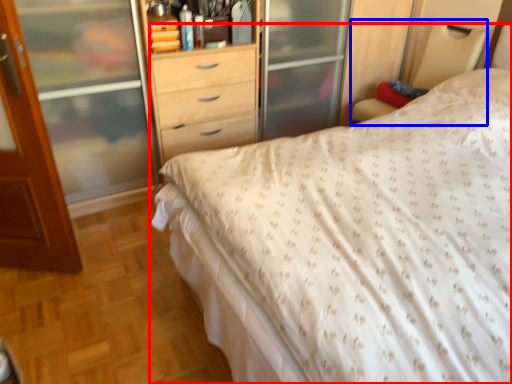
Question: Which point is closer to the camera, bed (highlighted by a red box) or bed frame (highlighted by a blue box)?

Choices:
 (A) bed
 (B) bed frame

Answer: (A)